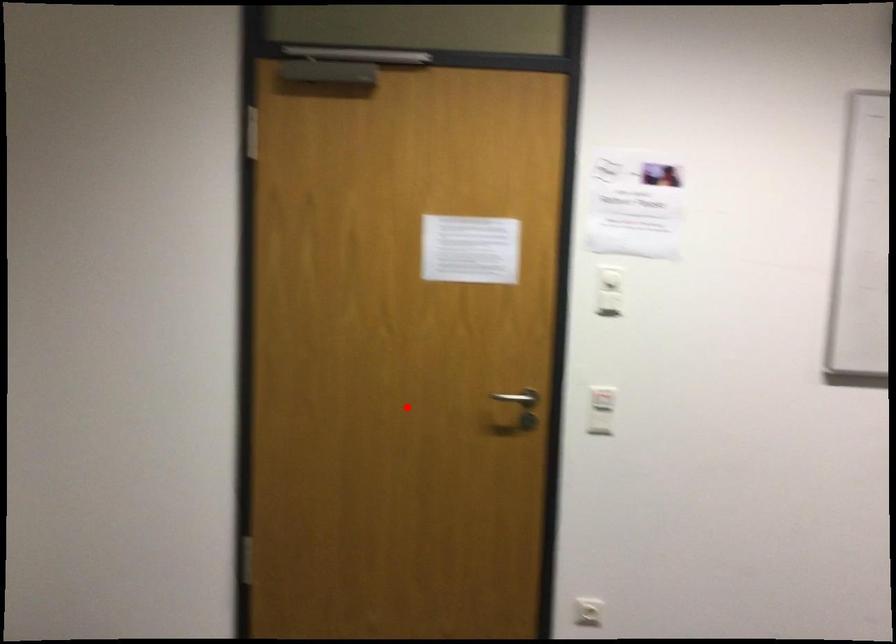
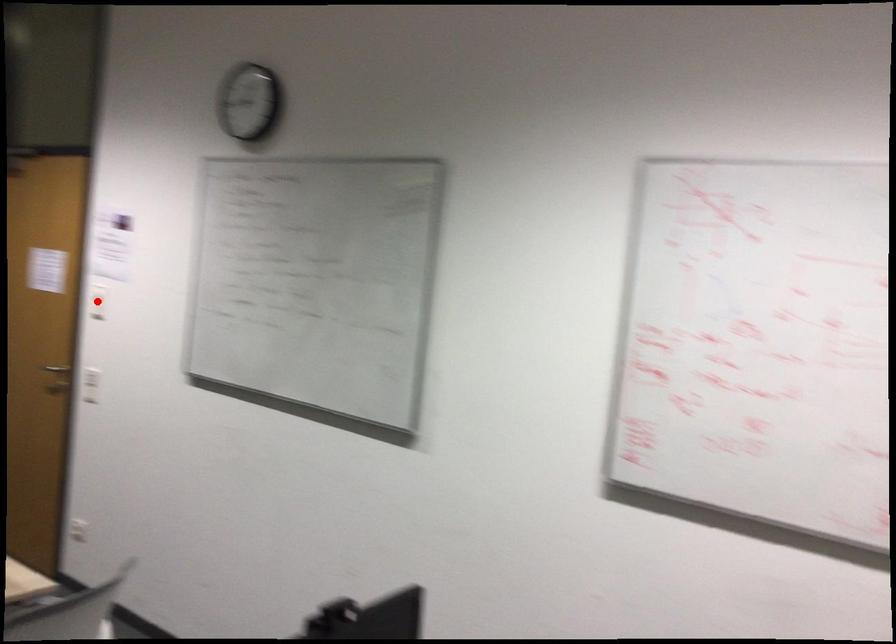
I am providing you with two images of the same scene from different viewpoints. A red point is marked on the first image and another point is marked on the second image. Is the marked point in image1 the same physical position as the marked point in image2?

No